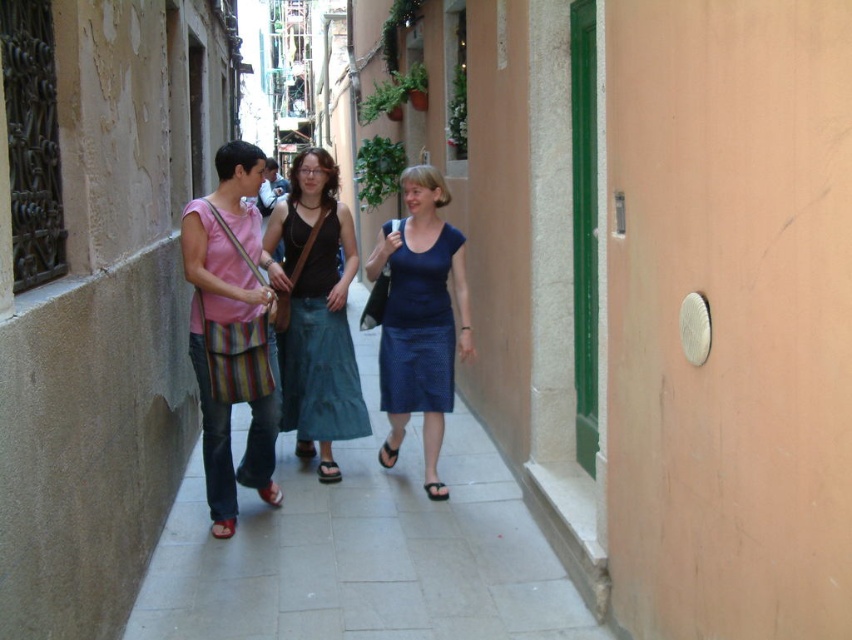
You are a photographer standing at the entrance of the alleyway. You want to take a photo of the matte black tank top at center. Where should you position your camera to capture it best?

The matte black tank top at center is located at the coordinates 0.478 on the x axis and 0.371 on the y axis, so position the camera at the entrance facing towards those coordinates to capture it best.

You are a photographer standing at the entrance of the alleyway. You want to capture a photo of the matte black tank top at center and the red leather sandal at lower left. Which object should you focus on first to ensure both are in sharp focus?

The red leather sandal at lower left is behind the matte black tank top at center, so you should focus on the matte black tank top at center first to ensure both are in sharp focus.